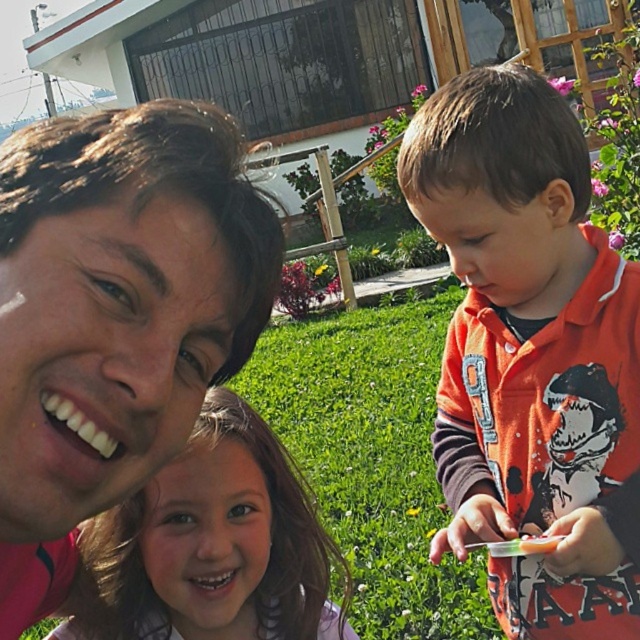
Can you confirm if orange fleece jacket at right is smaller than smooth brown hair at lower center?

Actually, orange fleece jacket at right might be larger than smooth brown hair at lower center.

Between orange fleece jacket at right and smooth brown hair at lower center, which one is positioned higher?

orange fleece jacket at right

Who is more distant from viewer, (568, 264) or (145, 621)?

Point (145, 621)

Locate an element on the screen. orange fleece jacket at right is located at coordinates (531, 355).

Which is in front, point (83, 509) or point (616, 596)?

Point (83, 509) is more forward.

Is point (140, 176) positioned in front of point (522, 444)?

That is True.

Is point (156, 353) closer to viewer compared to point (586, 598)?

Yes, it is in front of point (586, 598).

You are a GUI agent. You are given a task and a screenshot of the screen. Output one action in this format:
    pyautogui.click(x=<x>, y=<y>)
    Task: Click on the matte pink shirt at upper left
    
    Given the screenshot: What is the action you would take?
    pyautogui.click(x=115, y=316)

Which is below, matte pink shirt at upper left or smooth brown hair at lower center?

smooth brown hair at lower center is below.

In the scene shown: Can you confirm if matte pink shirt at upper left is wider than smooth brown hair at lower center?

No.

Between point (13, 292) and point (253, 460), which one is positioned behind?

Positioned behind is point (253, 460).

Where is `matte pink shirt at upper left`? This screenshot has height=640, width=640. matte pink shirt at upper left is located at coordinates (115, 316).